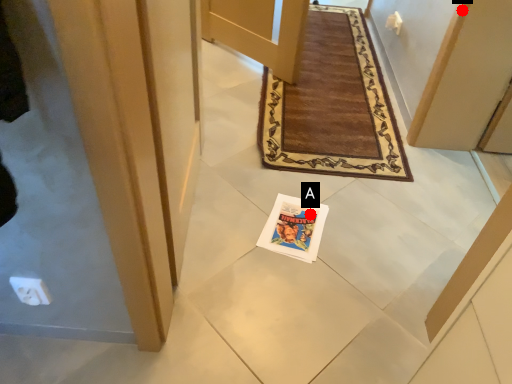
Question: Two points are circled on the image, labeled by A and B beside each circle. Which point is farther from the camera taking this photo?

Choices:
 (A) A is further
 (B) B is further

Answer: (A)